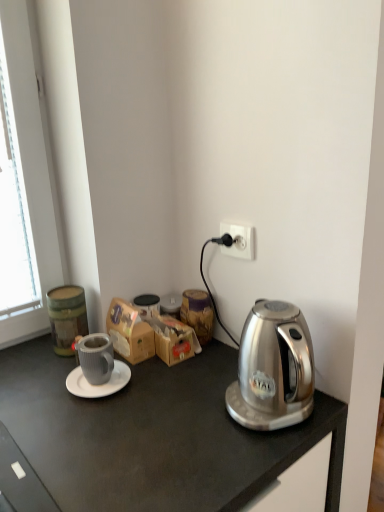
Question: Would you say white plastic power outlet at upper right contains wooden jar at center?

Choices:
 (A) no
 (B) yes

Answer: (A)

Question: Considering the relative sizes of white plastic power outlet at upper right and wooden jar at center in the image provided, is white plastic power outlet at upper right shorter than wooden jar at center?

Choices:
 (A) no
 (B) yes

Answer: (B)

Question: From a real-world perspective, is white plastic power outlet at upper right on top of wooden jar at center?

Choices:
 (A) no
 (B) yes

Answer: (B)

Question: From the image's perspective, would you say white plastic power outlet at upper right is positioned over wooden jar at center?

Choices:
 (A) yes
 (B) no

Answer: (A)

Question: Is white plastic power outlet at upper right far from wooden jar at center?

Choices:
 (A) yes
 (B) no

Answer: (B)

Question: From the image's perspective, is matte gray mug at center left positioned above or below wooden jar at center?

Choices:
 (A) below
 (B) above

Answer: (A)

Question: Considering the positions of matte gray mug at center left and wooden jar at center in the image, is matte gray mug at center left taller or shorter than wooden jar at center?

Choices:
 (A) short
 (B) tall

Answer: (A)

Question: Choose the correct answer: Is matte gray mug at center left inside wooden jar at center or outside it?

Choices:
 (A) outside
 (B) inside

Answer: (A)

Question: In the image, is matte gray mug at center left positioned in front of or behind wooden jar at center?

Choices:
 (A) front
 (B) behind

Answer: (A)

Question: From a real-world perspective, is white matte saucer at center positioned above or below brown cardboard box at center?

Choices:
 (A) above
 (B) below

Answer: (B)

Question: Visually, is white matte saucer at center positioned to the left or to the right of brown cardboard box at center?

Choices:
 (A) right
 (B) left

Answer: (B)

Question: In terms of height, does white matte saucer at center look taller or shorter compared to brown cardboard box at center?

Choices:
 (A) short
 (B) tall

Answer: (A)

Question: From the image's perspective, is white matte saucer at center located above or below brown cardboard box at center?

Choices:
 (A) below
 (B) above

Answer: (A)

Question: From a real-world perspective, is matte gray mug at center left positioned above or below brown cardboard box at center?

Choices:
 (A) above
 (B) below

Answer: (A)

Question: Based on their sizes in the image, would you say matte gray mug at center left is bigger or smaller than brown cardboard box at center?

Choices:
 (A) big
 (B) small

Answer: (B)